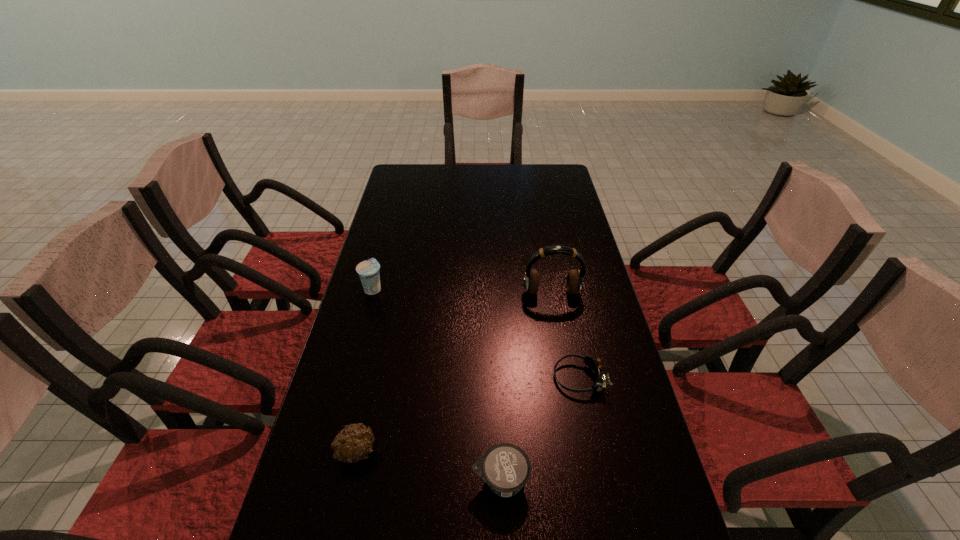
In the image, there is a desktop. Where is `free space at the left edge`? This screenshot has width=960, height=540. free space at the left edge is located at coordinates pyautogui.click(x=312, y=489).

Identify the location of vacant space at the right edge. The height and width of the screenshot is (540, 960). (594, 266).

Locate an element on the screen. vacant area at the far right corner is located at coordinates (555, 168).

The height and width of the screenshot is (540, 960). I want to click on free space that is in between the right yogurt and the tallest object, so pos(526,386).

I want to click on blank region between the taller yogurt and the tallest object, so click(463, 291).

The image size is (960, 540). In order to click on unoccupied position between the muffin and the third object from left to right in this screenshot , I will do `click(428, 466)`.

Locate an element on the screen. empty space between the third object from right to left and the goggles is located at coordinates (540, 429).

Identify the location of unoccupied position between the fourth shortest object and the muffin. (365, 370).

Where is `free space between the tallest object and the muffin`? free space between the tallest object and the muffin is located at coordinates (454, 372).

Where is `empty location between the muffin and the shorter yogurt`? Image resolution: width=960 pixels, height=540 pixels. empty location between the muffin and the shorter yogurt is located at coordinates (428, 466).